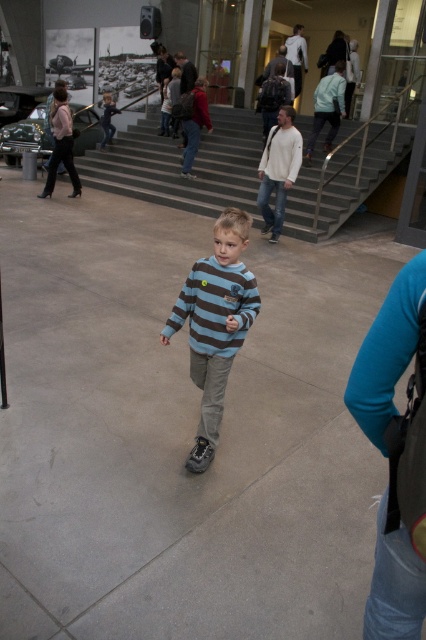
Question: Which object is the farthest from the matte red sweater at center?

Choices:
 (A) gray concrete stairs at center
 (B) striped sweater at center
 (C) striped cotton shirt at center

Answer: (C)

Question: Based on their relative distances, which object is nearer to the gray concrete stairs at center?

Choices:
 (A) gray concrete pavement at center
 (B) striped cotton shirt at center
 (C) matte pink jacket at upper left

Answer: (C)

Question: Is gray concrete pavement at center smaller than matte pink jacket at upper left?

Choices:
 (A) no
 (B) yes

Answer: (B)

Question: Is gray concrete pavement at center above matte pink jacket at upper left?

Choices:
 (A) yes
 (B) no

Answer: (B)

Question: Which point is closer to the camera?

Choices:
 (A) (192, 115)
 (B) (403, 154)
 (C) (213, 428)

Answer: (C)

Question: Does gray concrete stairs at center have a greater width compared to striped cotton shirt at center?

Choices:
 (A) no
 (B) yes

Answer: (B)